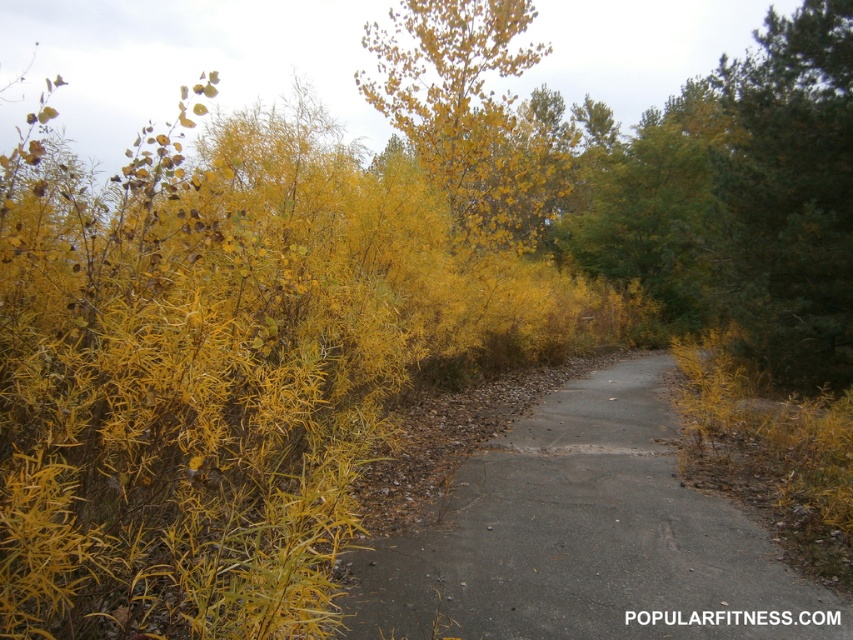
Question: Does gray asphalt trail at center appear over yellow leafy tree at upper center?

Choices:
 (A) yes
 (B) no

Answer: (B)

Question: Which of the following is the farthest from the observer?

Choices:
 (A) gray asphalt trail at center
 (B) yellow leafy tree at upper center

Answer: (B)

Question: Can you confirm if gray asphalt trail at center is positioned to the left of yellow leafy tree at upper center?

Choices:
 (A) yes
 (B) no

Answer: (A)

Question: Is gray asphalt trail at center below yellow leafy tree at upper center?

Choices:
 (A) yes
 (B) no

Answer: (A)

Question: Among these points, which one is nearest to the camera?

Choices:
 (A) (769, 554)
 (B) (521, 108)

Answer: (A)